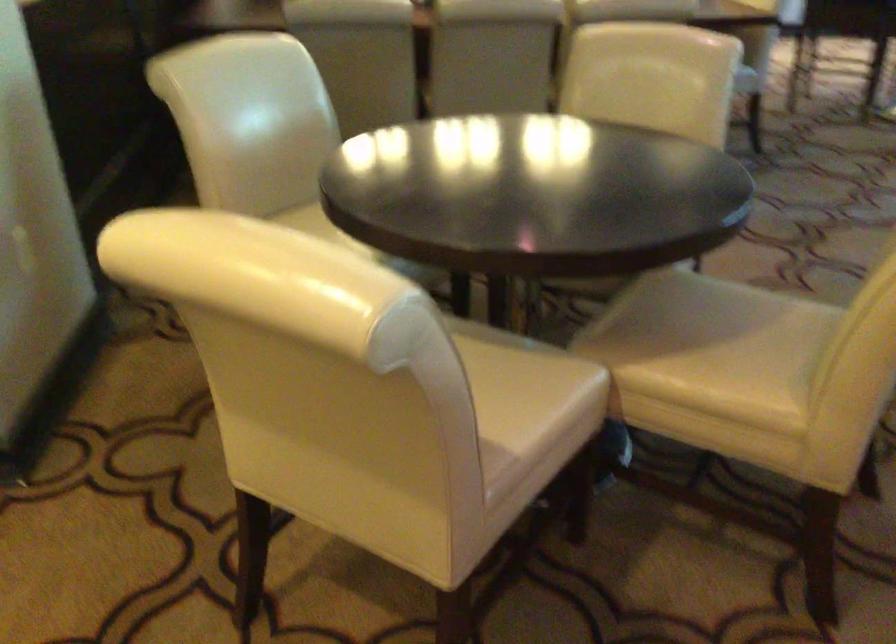
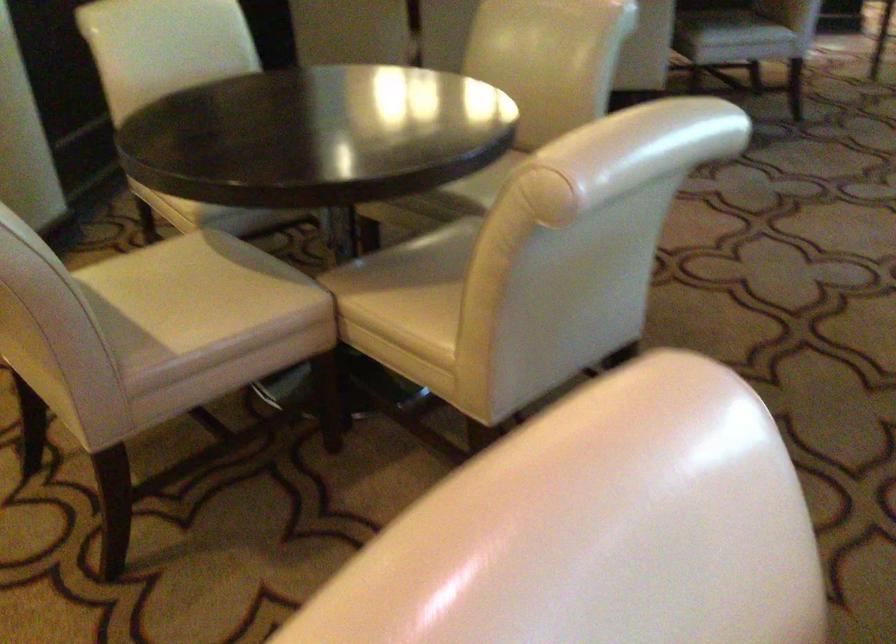
Question: In a continuous first-person perspective shot, in which direction is the camera moving?

Choices:
 (A) Left
 (B) Right
 (C) Forward
 (D) Backward

Answer: (B)